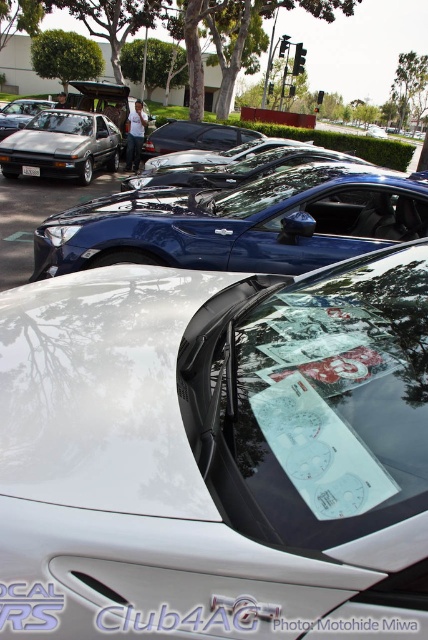
Question: Considering the real-world distances, which object is farthest from the matte black car at left?

Choices:
 (A) white glossy car at center
 (B) matte black windshield at center
 (C) metallic silver hatchback at left

Answer: (A)

Question: Which of the following is the farthest from the observer?

Choices:
 (A) (68, 131)
 (B) (366, 240)

Answer: (A)

Question: Is satin blue car at center above matte black car at left?

Choices:
 (A) no
 (B) yes

Answer: (A)

Question: Is white glossy car at center wider than matte black windshield at center?

Choices:
 (A) no
 (B) yes

Answer: (B)

Question: Which point appears closest to the camera in this image?

Choices:
 (A) (79, 563)
 (B) (244, 436)

Answer: (A)

Question: Is white glossy car at center positioned behind satin blue car at center?

Choices:
 (A) yes
 (B) no

Answer: (B)